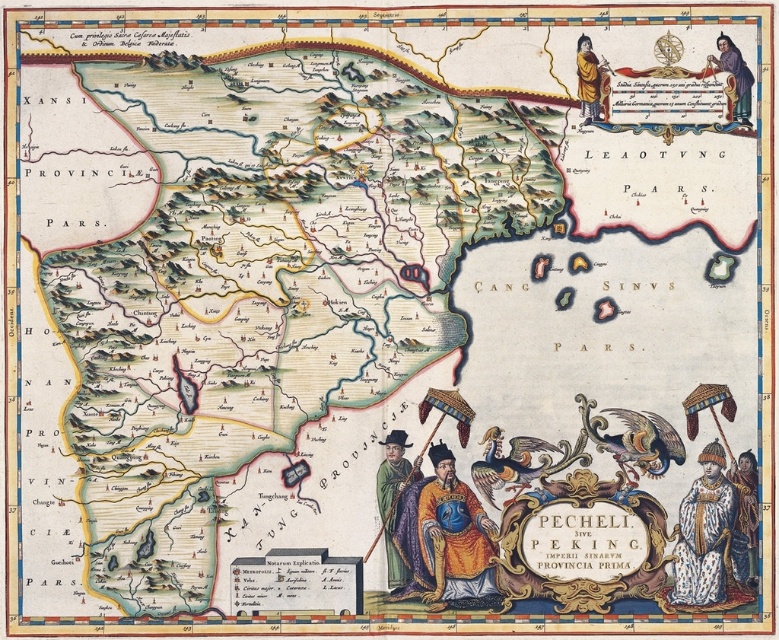
Based on the photo, does silk robe at lower right have a greater width compared to golden-yellow robe at upper right?

Yes.

Does silk robe at lower right have a smaller size compared to golden-yellow robe at upper right?

No, silk robe at lower right is not smaller than golden-yellow robe at upper right.

Is point (383, 484) farther from viewer compared to point (603, 92)?

No, (383, 484) is in front of (603, 92).

Where is `silk robe at lower right`? silk robe at lower right is located at coordinates (393, 500).

Measure the distance between golden silk robe at lower center and camera.

They are 165.30 feet apart.

Between golden silk robe at lower center and silk robe at lower right, which one has less height?

With less height is silk robe at lower right.

Image resolution: width=779 pixels, height=640 pixels. What are the coordinates of `golden silk robe at lower center` in the screenshot? It's located at (455, 538).

What are the coordinates of `golden silk robe at lower center` in the screenshot? It's located at (455, 538).

Is silk robe at right positioned at the back of smooth brown robe at upper right?

No, it is not.

Which is above, silk robe at right or smooth brown robe at upper right?

smooth brown robe at upper right is above.

The height and width of the screenshot is (640, 779). Describe the element at coordinates (744, 518) in the screenshot. I see `silk robe at right` at that location.

Locate an element on the screen. The width and height of the screenshot is (779, 640). silk robe at right is located at coordinates (744, 518).